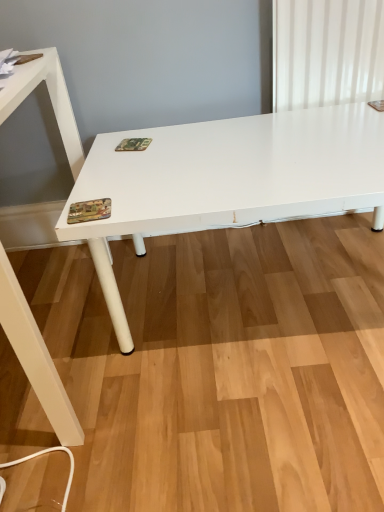
At what (x,y) coordinates should I click in order to perform the action: click on free space below white matte desk at left (from a real-world perspective). Please return your answer as a coordinate pair (x, y). Looking at the image, I should click on (64, 343).